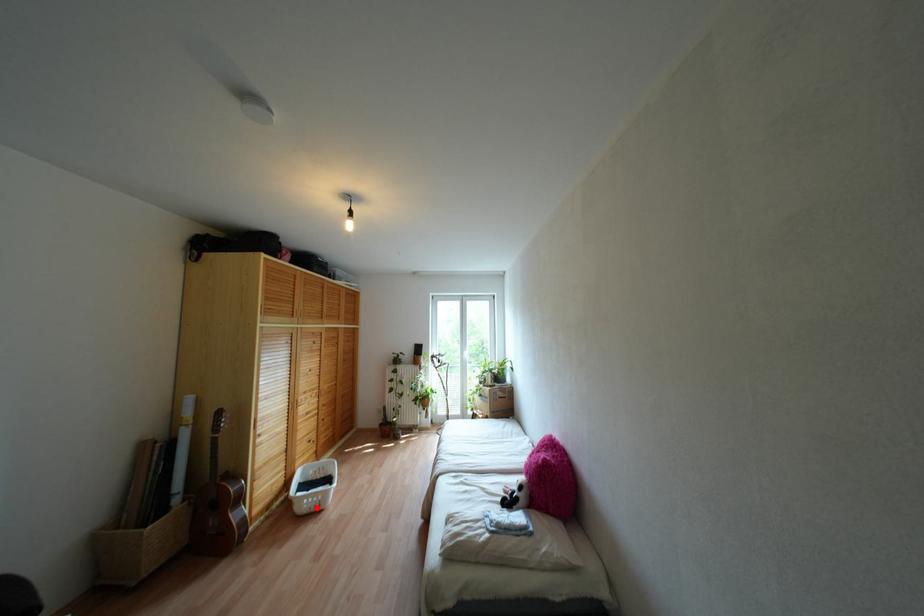
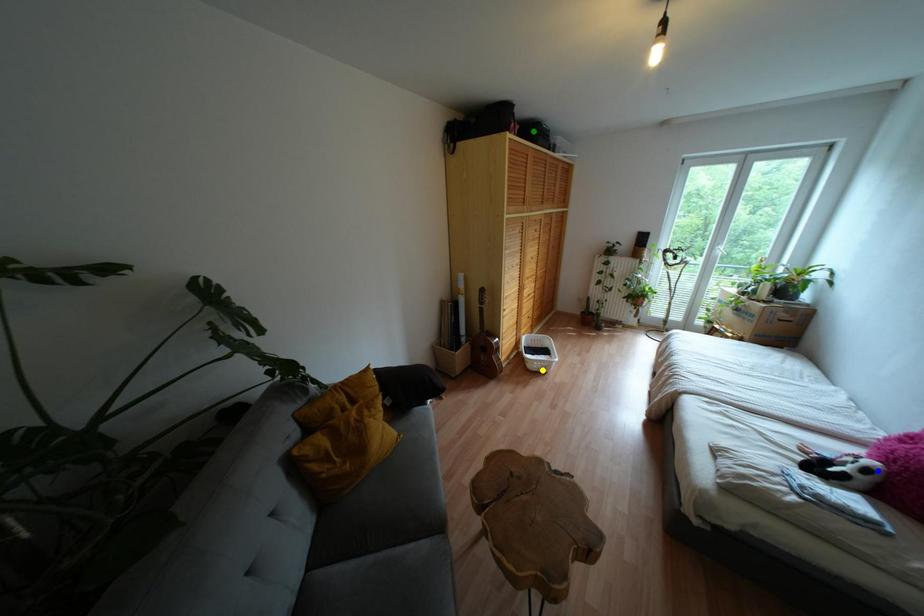
Question: I am providing you with two images of the same scene from different viewpoints. A red point is marked on the first image. You are given multiple points on the second image. Which point in image 2 represents the same 3d spot as the red point in image 1?

Choices:
 (A) yellow point
 (B) green point
 (C) blue point

Answer: (A)